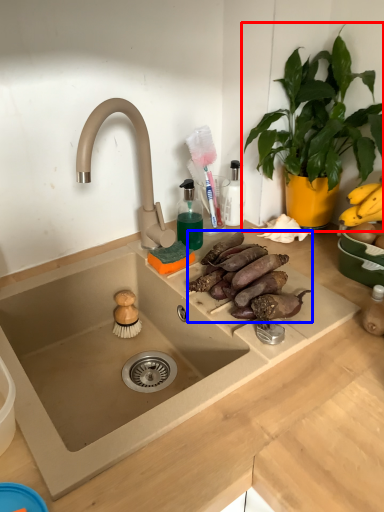
Question: Which point is further to the camera, houseplant (highlighted by a red box) or food (highlighted by a blue box)?

Choices:
 (A) houseplant
 (B) food

Answer: (B)